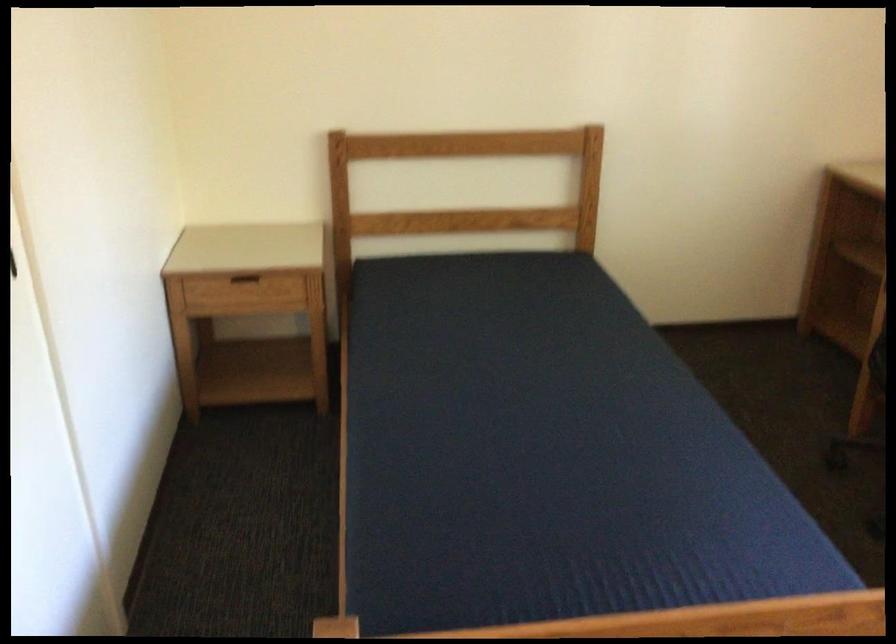
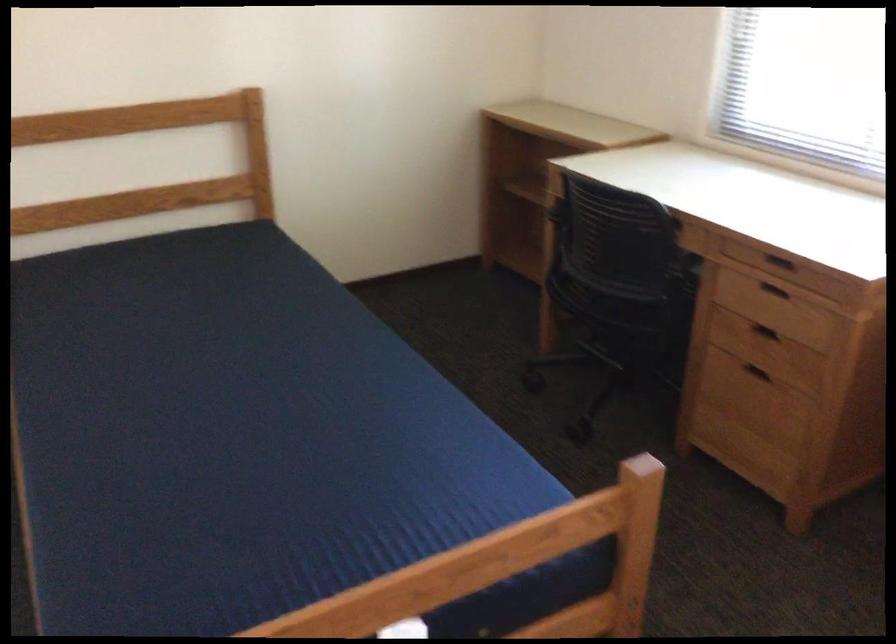
Question: The first image is from the beginning of the video and the second image is from the end. How did the camera likely rotate when shooting the video?

Choices:
 (A) Left
 (B) Right
 (C) Up
 (D) Down

Answer: (B)